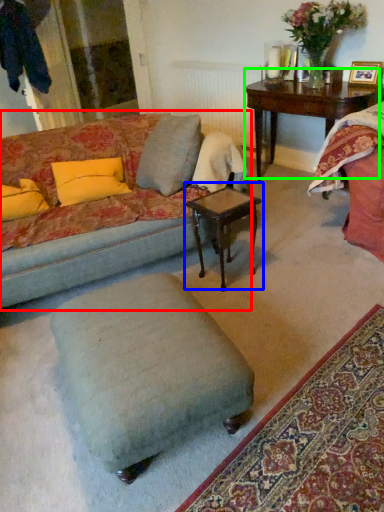
Question: Based on their relative distances, which object is farther from studio couch (highlighted by a red box)? Choose from coffee table (highlighted by a blue box) and table (highlighted by a green box).

Choices:
 (A) coffee table
 (B) table

Answer: (B)